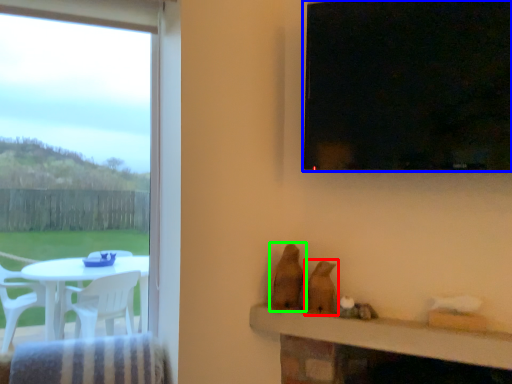
Question: Estimate the real-world distances between objects in this image. Which object is closer to animal (highlighted by a red box), window (highlighted by a blue box) or animal (highlighted by a green box)?

Choices:
 (A) window
 (B) animal

Answer: (B)